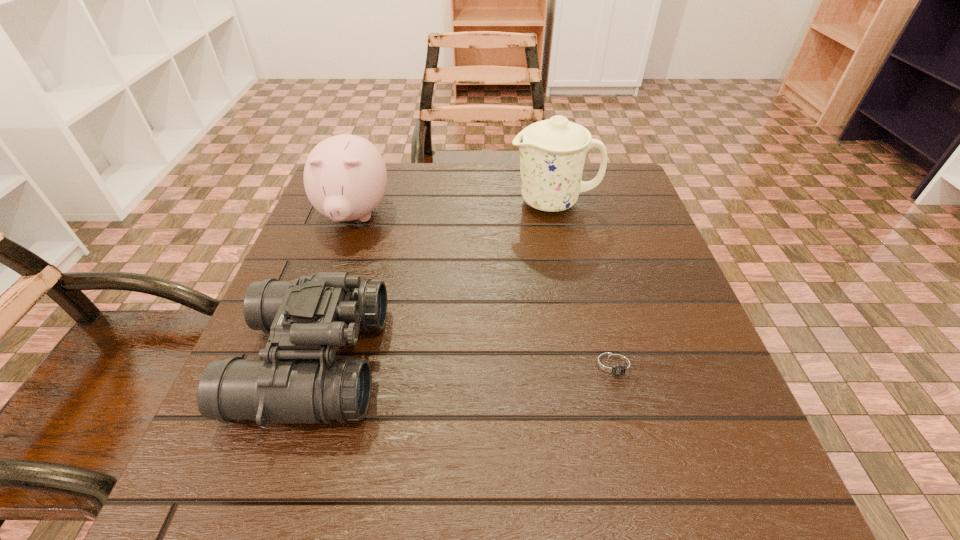
The image size is (960, 540). Identify the location of vacant space at the left edge. (328, 261).

Image resolution: width=960 pixels, height=540 pixels. In the image, there is a desktop. Identify the location of vacant space at the right edge. (650, 366).

You are a GUI agent. You are given a task and a screenshot of the screen. Output one action in this format:
    pyautogui.click(x=<x>, y=<y>)
    Task: Click on the vacant area at the far right corner of the desktop
    This screenshot has width=960, height=540.
    Given the screenshot: What is the action you would take?
    pyautogui.click(x=589, y=191)

Image resolution: width=960 pixels, height=540 pixels. Identify the location of empty space that is in between the shortest object and the second shortest object. (465, 363).

At what (x,y) coordinates should I click in order to perform the action: click on vacant area that lies between the shortest object and the third tallest object. Please return your answer as a coordinate pair (x, y). The height and width of the screenshot is (540, 960). Looking at the image, I should click on (465, 363).

Locate an element on the screen. The image size is (960, 540). free spot between the chinaware and the shortest object is located at coordinates (585, 284).

The image size is (960, 540). Identify the location of free area in between the watch and the second tallest object. (485, 291).

Locate an element on the screen. Image resolution: width=960 pixels, height=540 pixels. free point between the shortest object and the second tallest object is located at coordinates (485, 291).

I want to click on free point between the watch and the chinaware, so click(x=585, y=284).

You are a GUI agent. You are given a task and a screenshot of the screen. Output one action in this format:
    pyautogui.click(x=<x>, y=<y>)
    Task: Click on the free space between the watch and the third shortest object
    The height and width of the screenshot is (540, 960).
    Given the screenshot: What is the action you would take?
    pyautogui.click(x=485, y=291)